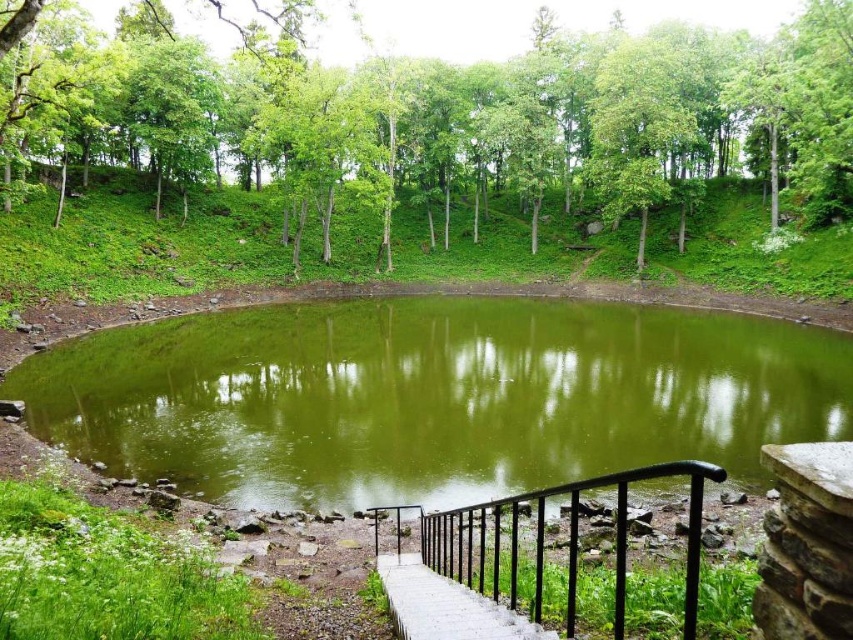
You are standing at the edge of the pond and want to take a photo of both the green leafy tree at upper center and the black metal railing at lower center. Which object should you position to your left side to capture both in the frame?

The green leafy tree at upper center is to the left of the black metal railing at lower center, so you should position the green leafy tree at upper center to your left side to include both in the photo.

You are standing at the edge of the pond and notice a point marked at coordinates (431, 397). What is located at that point?

The point at (431, 397) is where the green water at center is located.